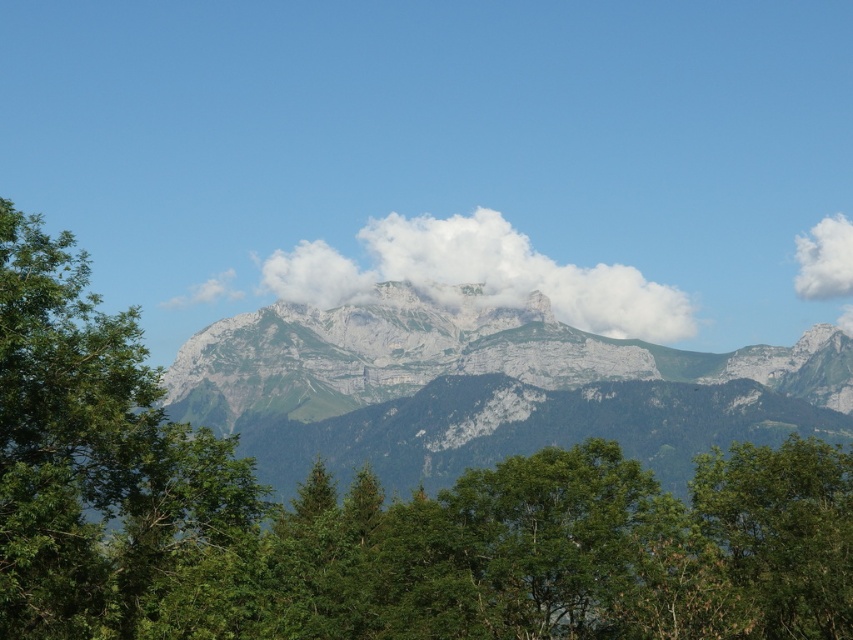
Is point (196, 556) farther from viewer compared to point (439, 234)?

No, (196, 556) is closer to viewer.

Does green leafy tree at left appear on the left side of white fluffy cloud at center?

Indeed, green leafy tree at left is positioned on the left side of white fluffy cloud at center.

What do you see at coordinates (107, 472) in the screenshot? This screenshot has width=853, height=640. I see `green leafy tree at left` at bounding box center [107, 472].

At what (x,y) coordinates should I click in order to perform the action: click on green leafy tree at left. Please return your answer as a coordinate pair (x, y). The image size is (853, 640). Looking at the image, I should click on (107, 472).

Is green leafy tree at center below gray/rocky mountain range at center?

Yes.

Is green leafy tree at center thinner than gray/rocky mountain range at center?

No.

Is point (281, 532) farther from viewer compared to point (606, 355)?

No, (281, 532) is in front of (606, 355).

The height and width of the screenshot is (640, 853). In order to click on green leafy tree at center in this screenshot , I will do 367,516.

Between green leafy tree at left and white fluffy cloud at upper right, which one appears on the left side from the viewer's perspective?

Positioned to the left is green leafy tree at left.

Between green leafy tree at left and white fluffy cloud at upper right, which one is positioned lower?

green leafy tree at left is below.

In order to click on green leafy tree at left in this screenshot , I will do `click(107, 472)`.